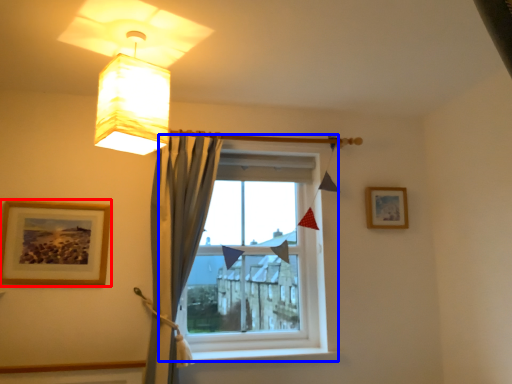
Question: Which of the following is the closest to the observer, picture frame (highlighted by a red box) or window (highlighted by a blue box)?

Choices:
 (A) picture frame
 (B) window

Answer: (A)